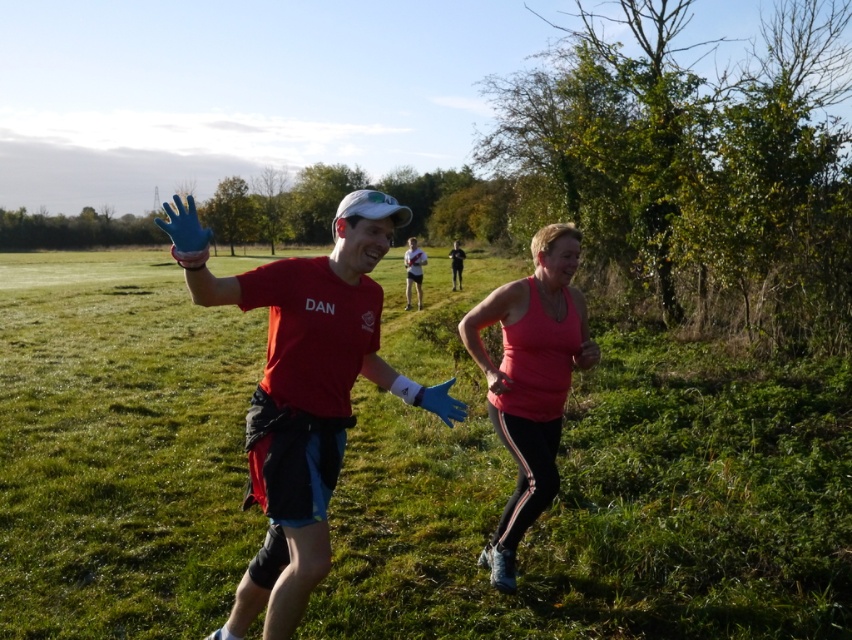
Is green grassy field at center below pink fabric tank top at center?

Incorrect, green grassy field at center is not positioned below pink fabric tank top at center.

Between point (6, 396) and point (514, 432), which one is positioned behind?

Point (6, 396)

Where is `green grassy field at center`? The height and width of the screenshot is (640, 852). green grassy field at center is located at coordinates (607, 506).

Measure the distance between matte blue gloves at center and pink fabric tank top at center.

matte blue gloves at center is 1.12 meters away from pink fabric tank top at center.

At what (x,y) coordinates should I click in order to perform the action: click on matte blue gloves at center. Please return your answer as a coordinate pair (x, y). Image resolution: width=852 pixels, height=640 pixels. Looking at the image, I should click on (303, 390).

Where is `matte blue gloves at center`? The height and width of the screenshot is (640, 852). matte blue gloves at center is located at coordinates (303, 390).

How distant is green grassy field at center from matte blue gloves at center?

green grassy field at center is 3.64 meters from matte blue gloves at center.

What do you see at coordinates (607, 506) in the screenshot? The image size is (852, 640). I see `green grassy field at center` at bounding box center [607, 506].

Locate an element on the screen. The height and width of the screenshot is (640, 852). green grassy field at center is located at coordinates (607, 506).